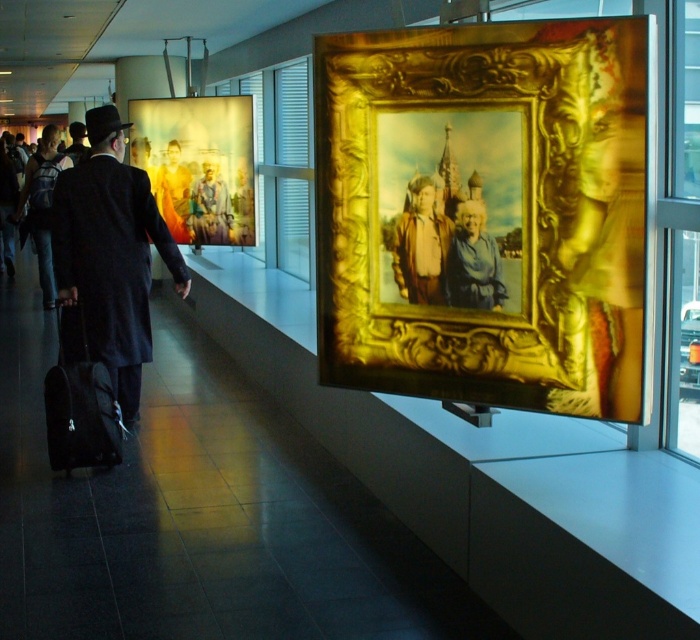
Question: Can you confirm if gold ornate frame at upper center is positioned below black wool coat at center?

Choices:
 (A) no
 (B) yes

Answer: (A)

Question: Is gold ornate frame at upper center closer to camera compared to black fabric suitcase at lower left?

Choices:
 (A) yes
 (B) no

Answer: (A)

Question: Which is farther from the brown leather jacket at center?

Choices:
 (A) gold ornate frame at upper center
 (B) matte gold picture frame at center
 (C) black fabric suitcase at lower left
 (D) black wool coat at center

Answer: (B)

Question: Does gold ornate frame at upper center appear on the left side of matte gold picture frame at center?

Choices:
 (A) no
 (B) yes

Answer: (A)

Question: Among these points, which one is farthest from the camera?

Choices:
 (A) (83, 337)
 (B) (139, 253)

Answer: (A)

Question: Which object is positioned closest to the black wool coat at center?

Choices:
 (A) matte gold picture frame at center
 (B) brown leather jacket at center
 (C) black fabric suitcase at lower left

Answer: (C)